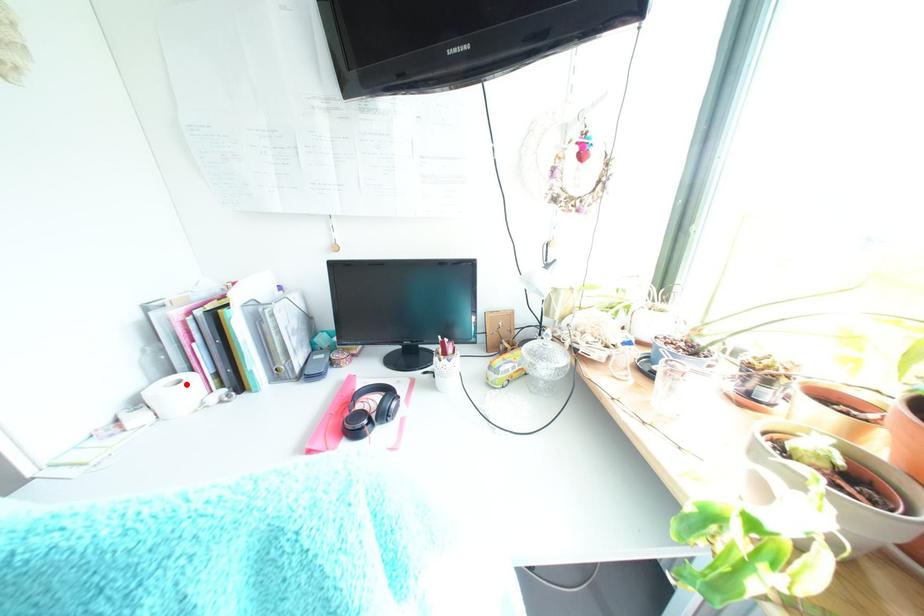
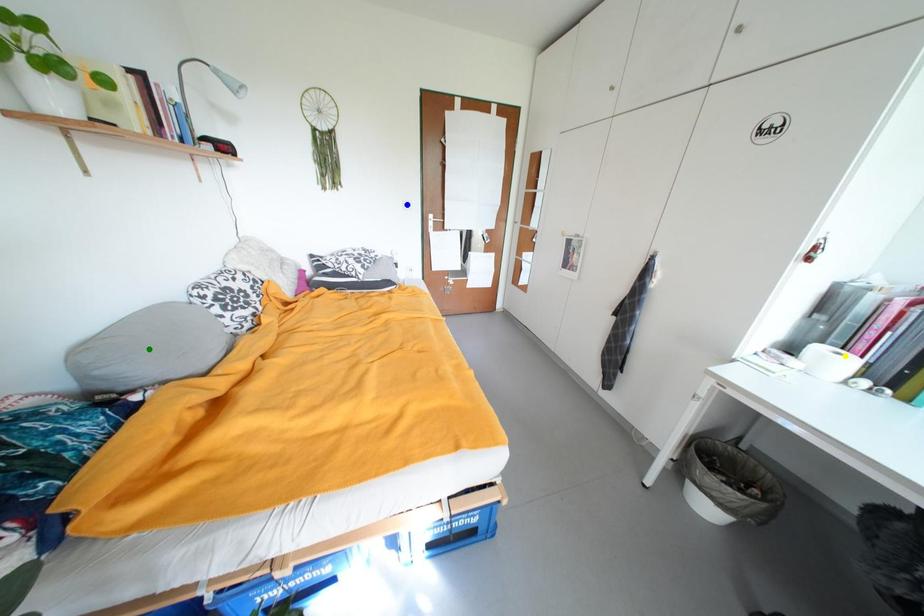
Question: I am providing you with two images of the same scene from different viewpoints. A red point is marked on the first image. You are given multiple points on the second image. Which spot in image 2 lines up with the point in image 1?

Choices:
 (A) yellow point
 (B) blue point
 (C) green point

Answer: (A)